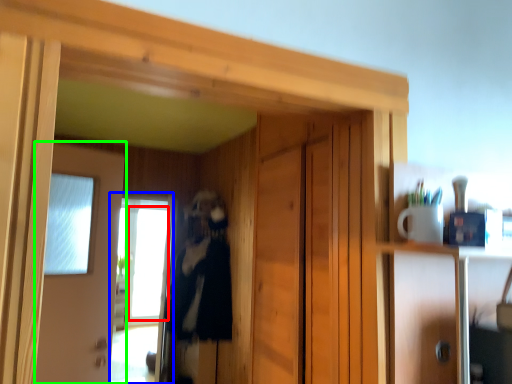
Question: Which object is the farthest from window (highlighted by a red box)? Choose among these: screen door (highlighted by a blue box) or door (highlighted by a green box).

Choices:
 (A) screen door
 (B) door

Answer: (B)